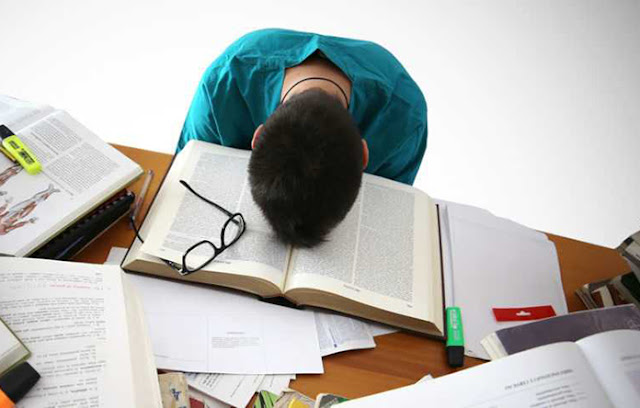
Locate an element on the screen. The width and height of the screenshot is (640, 408). books is located at coordinates (527, 381), (550, 331), (370, 258), (67, 206), (104, 325), (12, 345), (604, 292), (628, 280), (628, 249).